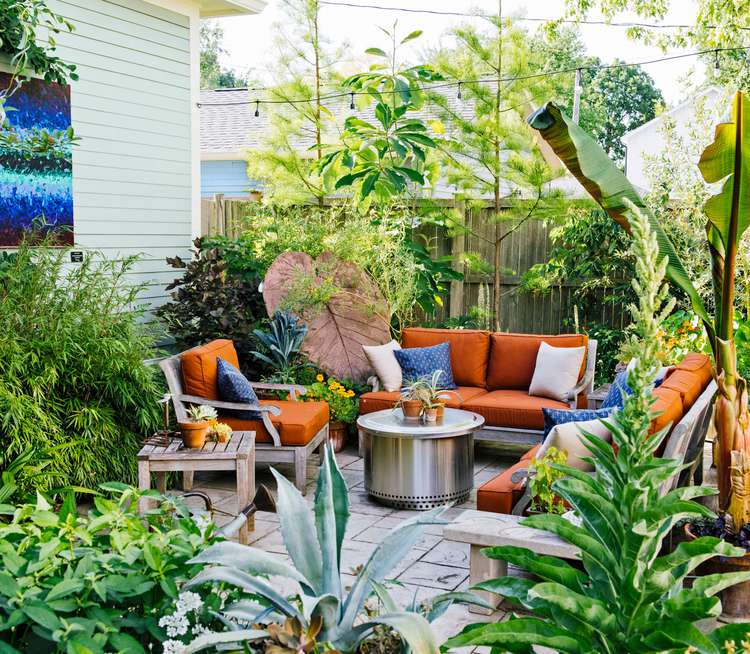
The width and height of the screenshot is (750, 654). What are the coordinates of `grey wooden  table` in the screenshot? It's located at (231, 458).